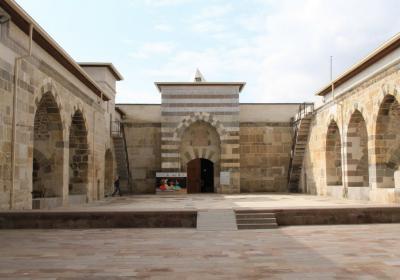
You are a GUI agent. You are given a task and a screenshot of the screen. Output one action in this format:
    pyautogui.click(x=<x>, y=<y>)
    Task: Click on the open arch doorway rt side
    
    Given the screenshot: What is the action you would take?
    pyautogui.click(x=205, y=172)